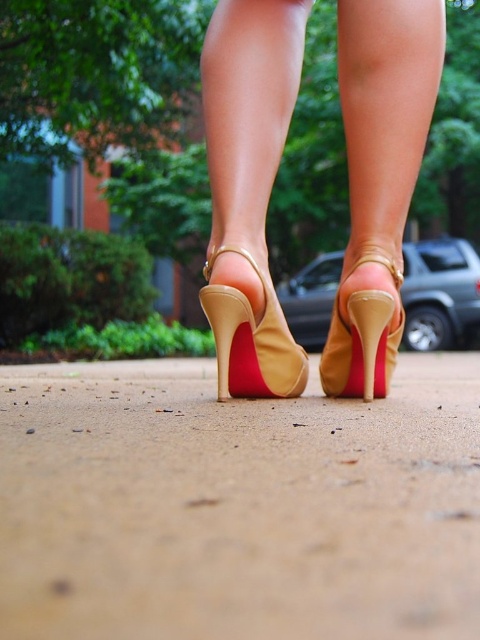
You are a delivery person who needs to park your metallic silver car at center on the sandy beige pavement at center. Is there enough space for the car to fit on the pavement?

The sandy beige pavement at center is positioned under the metallic silver car at center, which means the car is already parked there. Therefore, there is sufficient space for the metallic silver car at center to fit on the sandy beige pavement at center.

You are a photographer trying to capture the metallic silver car at center in the image. Where exactly should you position your camera to ensure the car is centered in your shot?

To center the metallic silver car at center in your shot, position your camera at point coordinates of approximately 0.458 on the x axis and 0.917 on the y axis.

You are a delivery robot navigating a sidewalk. You need to deliver a package to the sandy beige pavement at center. Your current position is at point (238, 504). Is your current position the correct location to drop the package?

Yes, your current position at point (238, 504) is the correct location to drop the package because the sandy beige pavement at center is located at that point.